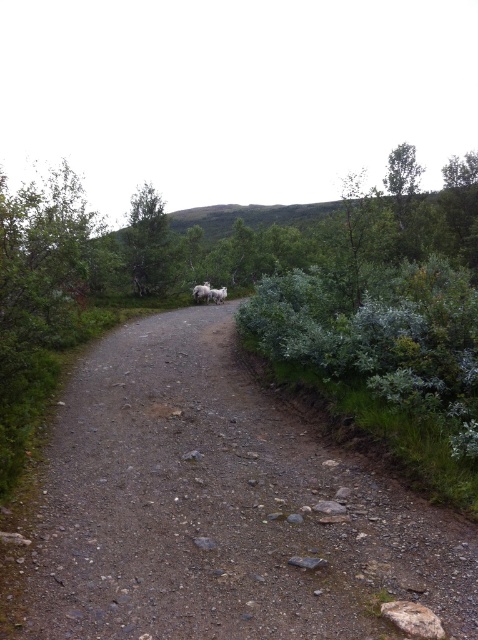
Which is above, dusty gravel path at center or green leafy tree at upper center?

green leafy tree at upper center is higher up.

Where is `dusty gravel path at center`? Image resolution: width=478 pixels, height=640 pixels. dusty gravel path at center is located at coordinates (217, 508).

Does point (235, 520) lie behind point (162, 284)?

That is False.

Find the location of a particular element. dusty gravel path at center is located at coordinates (217, 508).